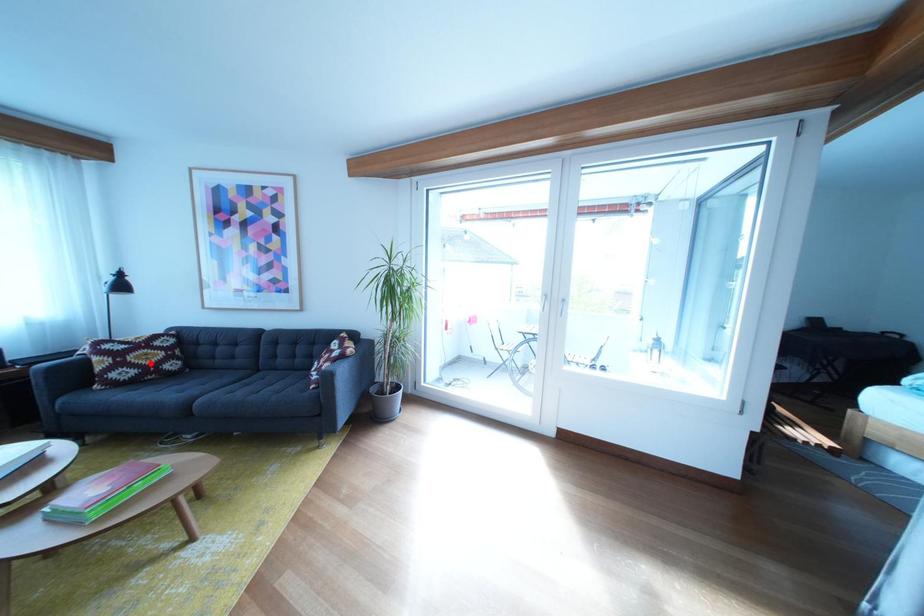
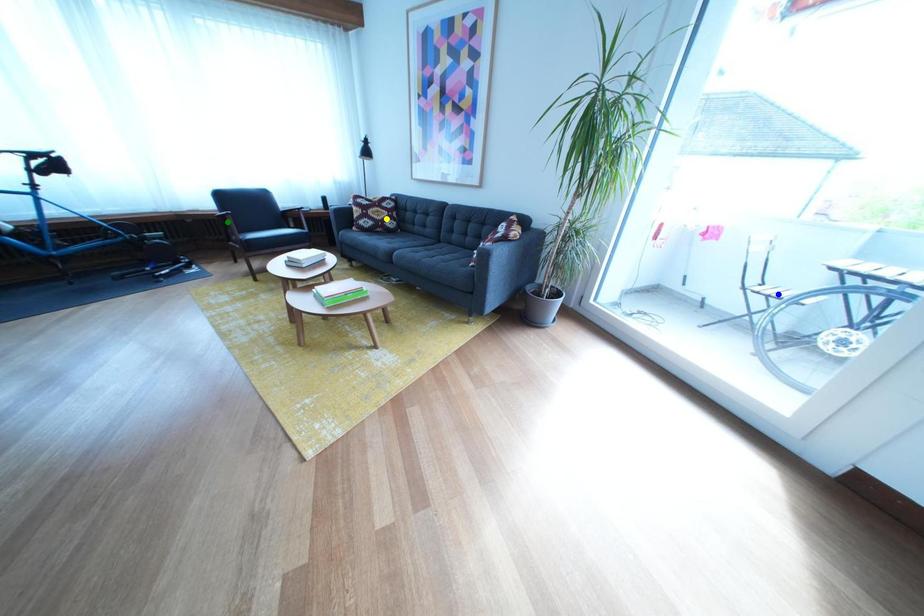
Question: I am providing you with two images of the same scene from different viewpoints. A red point is marked on the first image. You are given multiple points on the second image. Which point in image 2 represents the same 3d spot as the red point in image 1?

Choices:
 (A) yellow point
 (B) green point
 (C) blue point

Answer: (A)